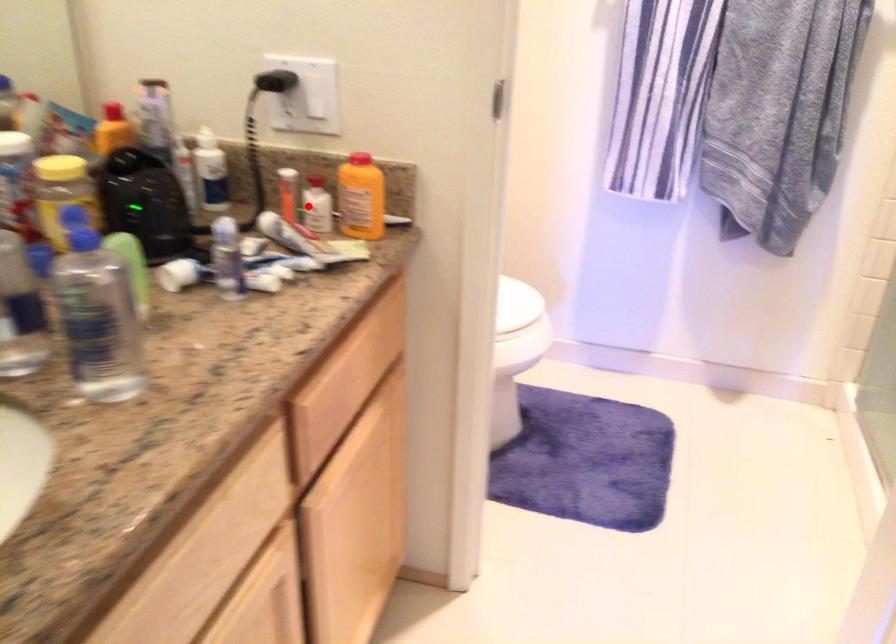
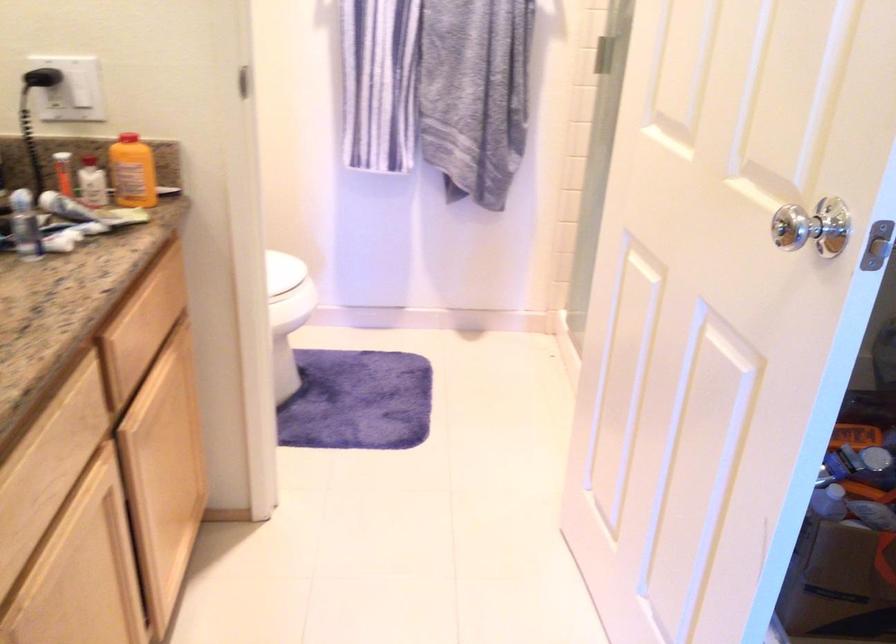
Find the pixel in the second image that matches the highlighted location in the first image.

(92, 182)